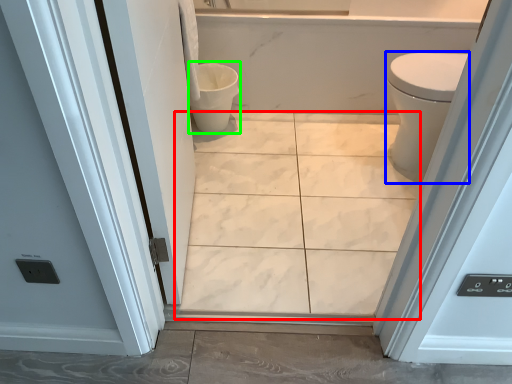
Question: Considering the real-world distances, which object is closest to ceramic tile (highlighted by a red box)? bidet (highlighted by a blue box) or toilet bowl (highlighted by a green box).

Choices:
 (A) bidet
 (B) toilet bowl

Answer: (A)